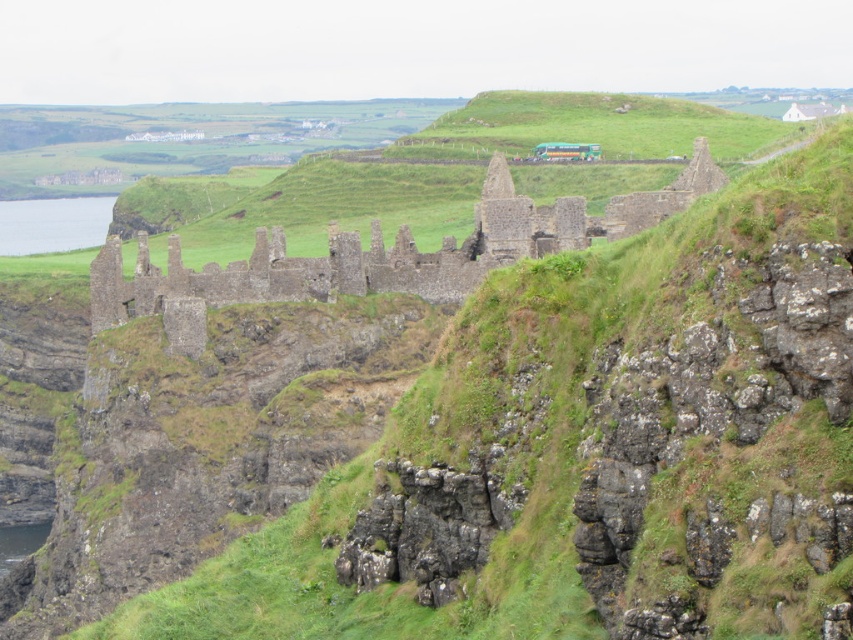
You are a hiker who has reached the edge of the cliff. You see the rustic stone ruins at center and the clear blue water at left. Which object is closer to you as you stand at the cliff edge?

The rustic stone ruins at center is closer to you since it is in front of the clear blue water at left.

You are standing at the cliff edge in the rugged landscape and see two points marked on the cliff face. Which point is closer to you, point (676, 202) or point (15, 244)?

Point (676, 202) is closer to the viewer than point (15, 244).

In the scene shown: You are a hiker planning to cross from the rustic stone ruins at center to the clear blue water at left. Given their widths, which path would be wider and safer for your journey?

The rustic stone ruins at center is wider than the clear blue water at left, so the path near the rustic stone ruins at center would be wider and safer for your journey.